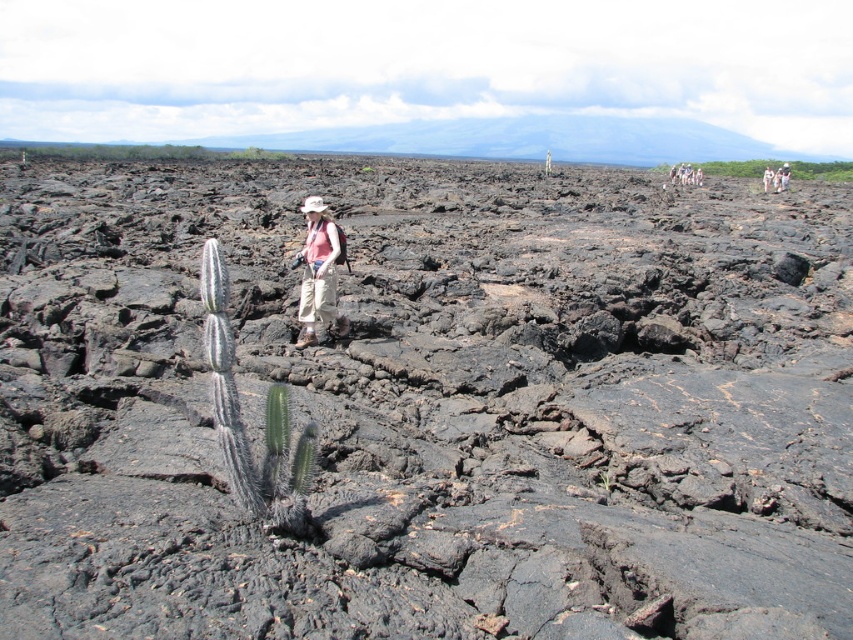
You are a photographer trying to capture both the matte pink shirt at center and the green spiky cactus at upper right in the same frame. Given their sizes, which object would you need to position closer to the camera to ensure both fit adequately in the photo?

Since the matte pink shirt at center is smaller than the green spiky cactus at upper right, you would need to move the matte pink shirt at center closer to the camera to make it appear larger in the frame, ensuring both objects are proportionally represented.

You are a photographer trying to capture the green spiky cactus at upper right and the matte pink shirt at center in the same frame. Which object should you focus on first if you want to ensure both are in focus?

The green spiky cactus at upper right is further away from the matte pink shirt at center, so you should focus on the matte pink shirt at center first to ensure both are in focus.